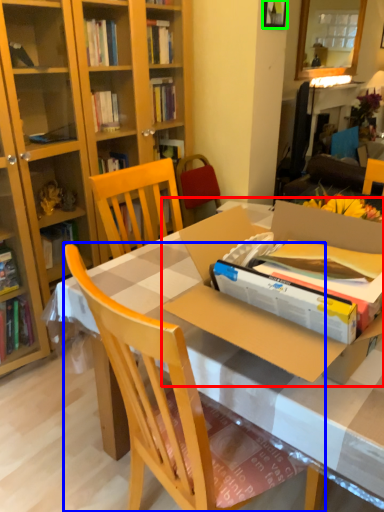
Question: Which object is the farthest from cardboard box (highlighted by a red box)? Choose among these: chair (highlighted by a blue box) or picture frame (highlighted by a green box).

Choices:
 (A) chair
 (B) picture frame

Answer: (B)